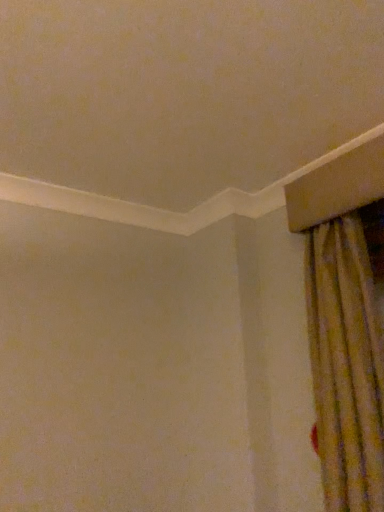
Describe the element at coordinates (346, 364) in the screenshot. I see `yellow floral fabric curtain at right` at that location.

Where is `yellow floral fabric curtain at right`? The width and height of the screenshot is (384, 512). yellow floral fabric curtain at right is located at coordinates (346, 364).

At what (x,y) coordinates should I click in order to perform the action: click on yellow floral fabric curtain at right. Please return your answer as a coordinate pair (x, y). The image size is (384, 512). Looking at the image, I should click on (346, 364).